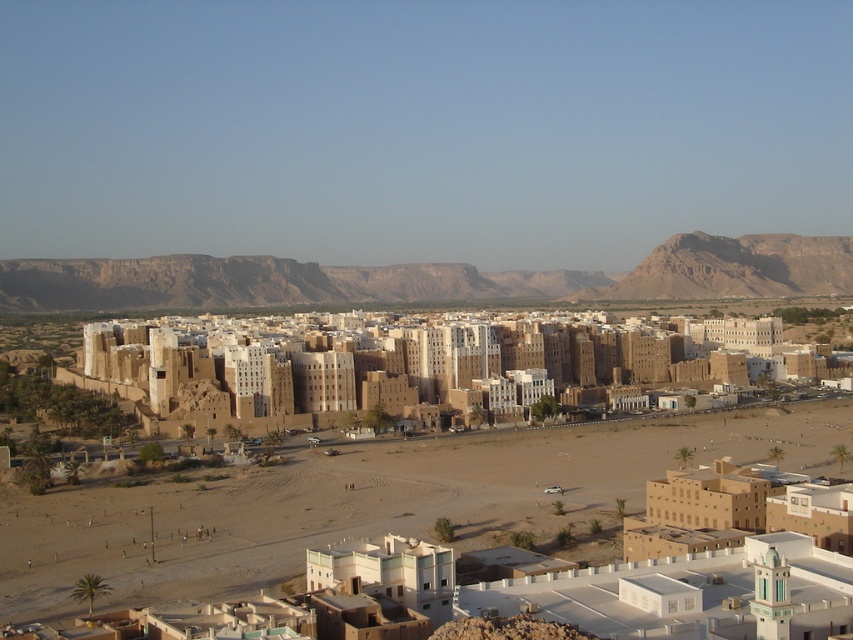
You are a hiker who has just arrived at the desert town. You see the brown sand at lower center and the sparse vegetation in the foreground. How far apart are these two landmarks?

The brown sand at lower center and the sparse vegetation in the foreground are 97.41 meters apart.